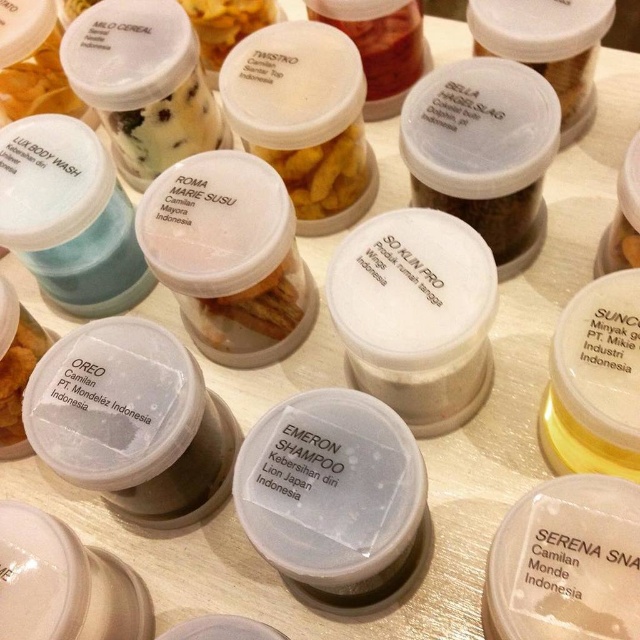
You are standing in a store and see the transparent plastic shampoo at center and the yellow matte snack at center. How far apart are these two items?

The transparent plastic shampoo at center is 32.49 inches from the yellow matte snack at center.

You are organizing snacks on a shelf and see the white plastic container at upper left and the white plastic oreo at center. Which one is located to the left of the other?

The white plastic container at upper left is positioned on the left side of white plastic oreo at center.

You are organizing a shelf and need to stack items vertically. You have a transparent plastic shampoo at center and a translucent plastic snack at center. Which item should you place at the bottom to ensure stability?

You should place the transparent plastic shampoo at center at the bottom because it is much taller than the translucent plastic snack at center, providing a stable base for stacking.